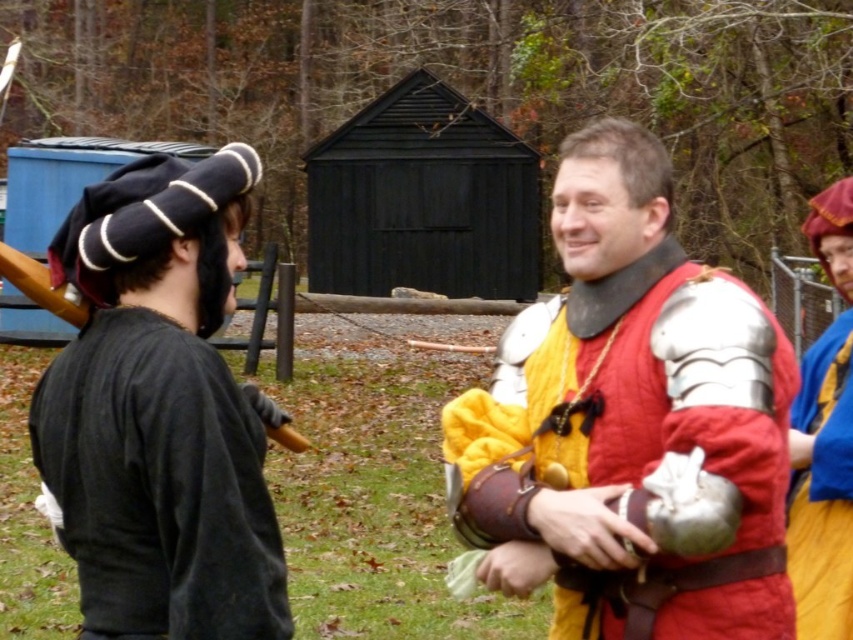
Is black velvet hat at left smaller than velvet blue robe at right?

No, black velvet hat at left is not smaller than velvet blue robe at right.

Based on the photo, which is above, black velvet hat at left or velvet blue robe at right?

black velvet hat at left is above.

The image size is (853, 640). What do you see at coordinates (160, 412) in the screenshot? I see `black velvet hat at left` at bounding box center [160, 412].

Where is `black velvet hat at left`? black velvet hat at left is located at coordinates (160, 412).

The width and height of the screenshot is (853, 640). Describe the element at coordinates (639, 420) in the screenshot. I see `metallic armor at center` at that location.

Which of these two, metallic armor at center or black velvet hat at left, stands taller?

With more height is metallic armor at center.

Who is more forward, (608, 628) or (228, 509)?

Point (228, 509)

Locate an element on the screen. The width and height of the screenshot is (853, 640). metallic armor at center is located at coordinates (639, 420).

Can you confirm if metallic armor at center is positioned to the right of velvet blue robe at right?

In fact, metallic armor at center is to the left of velvet blue robe at right.

Does point (715, 480) come behind point (799, 509)?

No, (715, 480) is in front of (799, 509).

Who is more distant from viewer, (x=675, y=356) or (x=804, y=557)?

Point (x=804, y=557)

Identify the location of metallic armor at center. (639, 420).